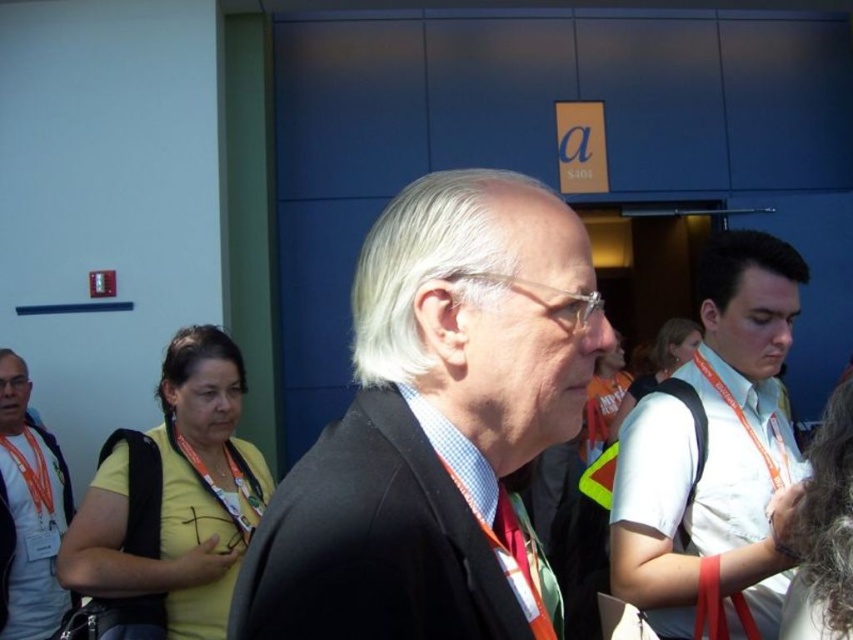
Which is more to the right, black suit at center or black matte suit at center?

Positioned to the right is black matte suit at center.

The image size is (853, 640). I want to click on black suit at center, so click(432, 420).

Where is `black suit at center`? The width and height of the screenshot is (853, 640). black suit at center is located at coordinates (432, 420).

Is black suit at center smaller than orange lanyard at left?

Yes, black suit at center is smaller than orange lanyard at left.

Can you confirm if black suit at center is positioned to the left of orange lanyard at left?

No, black suit at center is not to the left of orange lanyard at left.

The height and width of the screenshot is (640, 853). What do you see at coordinates (432, 420) in the screenshot?
I see `black suit at center` at bounding box center [432, 420].

Find the location of a particular element. This screenshot has height=640, width=853. black suit at center is located at coordinates (432, 420).

Does point (737, 284) come closer to viewer compared to point (33, 486)?

That is True.

Who is lower down, white shirt at right or orange lanyard at left?

orange lanyard at left is below.

What are the coordinates of `white shirt at right` in the screenshot? It's located at (715, 451).